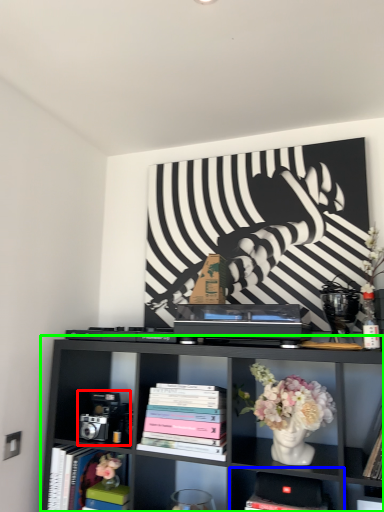
Question: Which object is positioned farthest from toy (highlighted by a red box)? Select from shelf (highlighted by a blue box) and shelf (highlighted by a green box).

Choices:
 (A) shelf
 (B) shelf

Answer: (A)